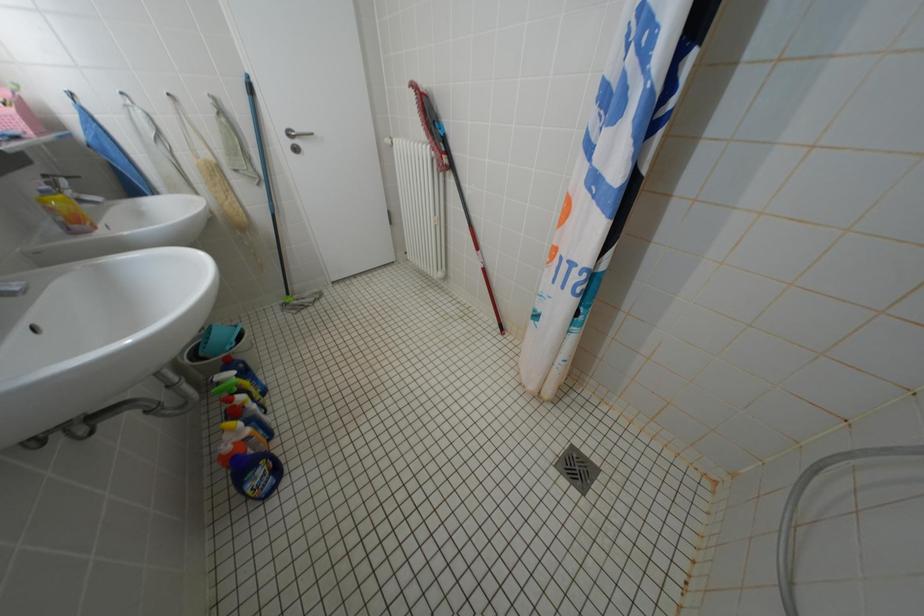
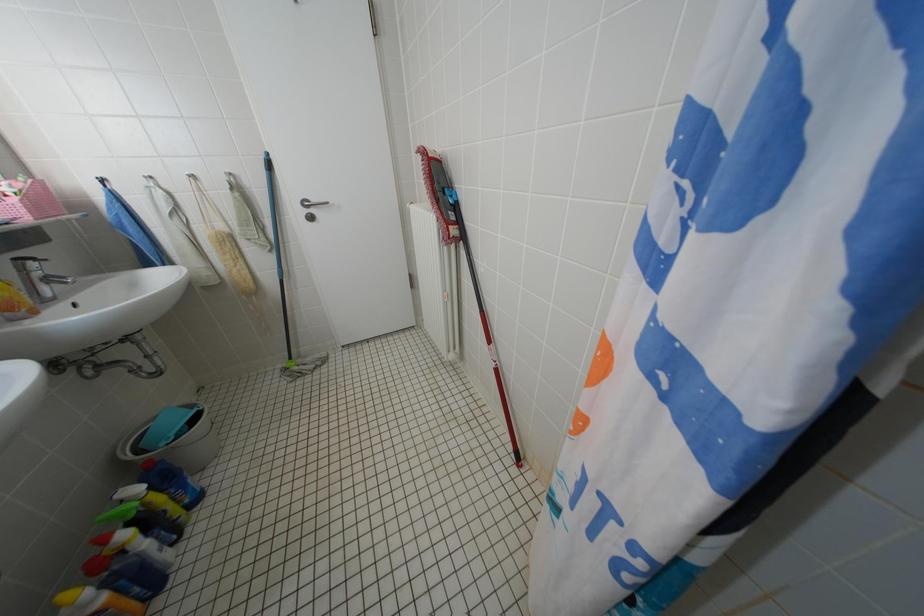
Question: How did the camera likely rotate?

Choices:
 (A) Left
 (B) Right
 (C) Up
 (D) Down

Answer: (A)